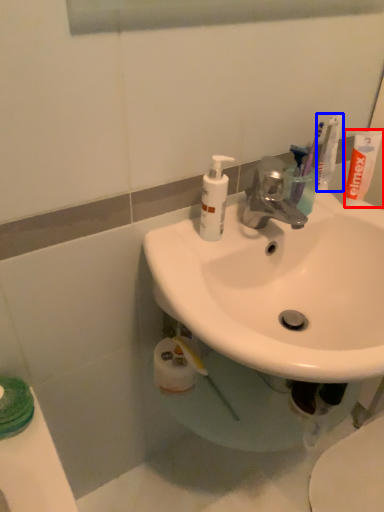
Question: Which of the following is the closest to the observer, toothpaste (highlighted by a red box) or toothbrush (highlighted by a blue box)?

Choices:
 (A) toothpaste
 (B) toothbrush

Answer: (A)